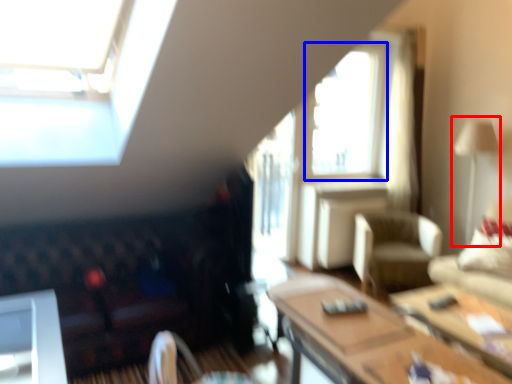
Question: Which object is closer to the camera taking this photo, lamp (highlighted by a red box) or window (highlighted by a blue box)?

Choices:
 (A) lamp
 (B) window

Answer: (A)